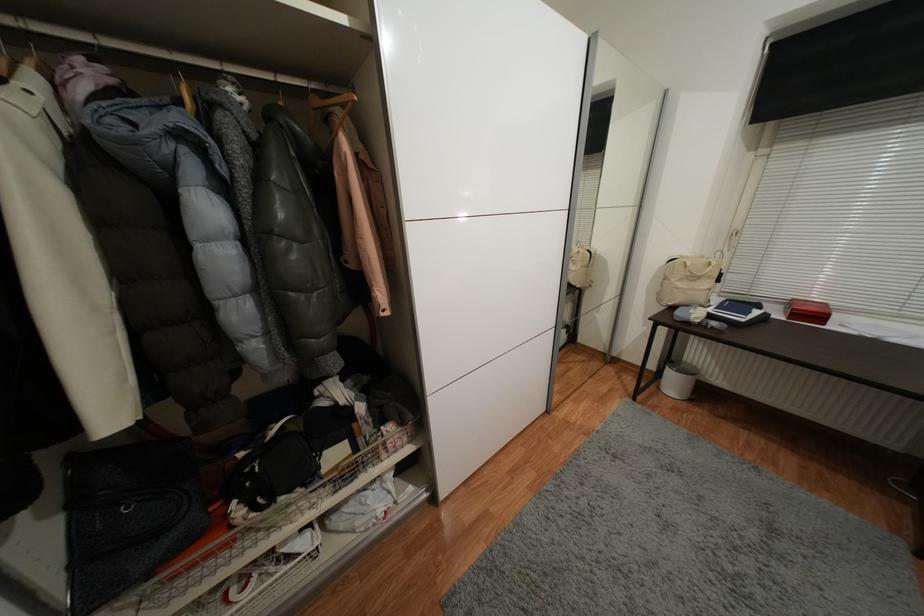
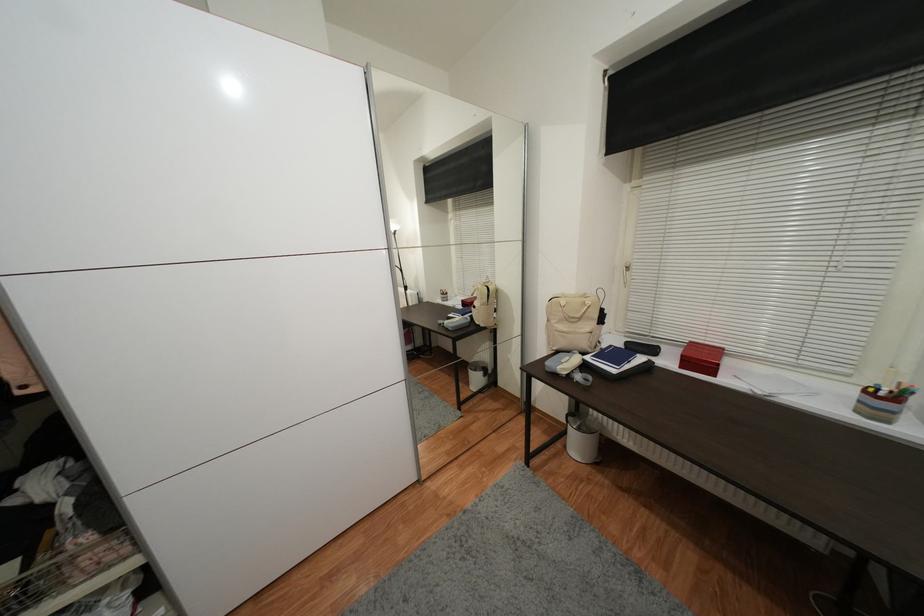
In the second image, find the point that corresponds to point (663, 390) in the first image.

(569, 448)